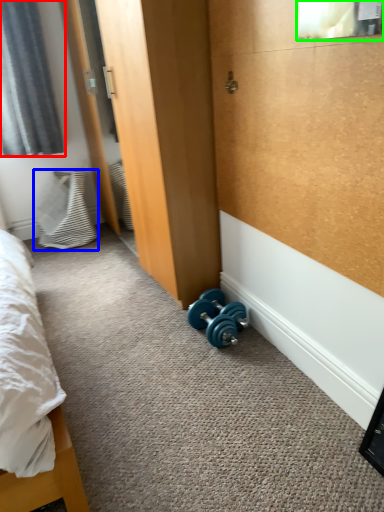
Question: Estimate the real-world distances between objects in this image. Which object is farther from curtain (highlighted by a red box), pillow (highlighted by a blue box) or window screen (highlighted by a green box)?

Choices:
 (A) pillow
 (B) window screen

Answer: (B)